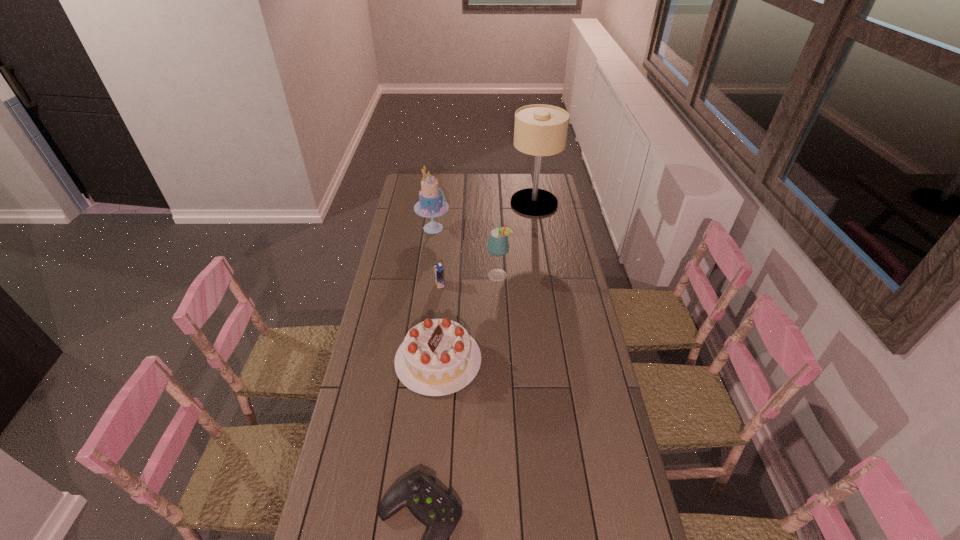
Identify the location of empty space that is in between the birthday cake and the tallest object. (486, 281).

This screenshot has height=540, width=960. I want to click on free space between the third shortest object and the second object from right to left, so click(468, 318).

The width and height of the screenshot is (960, 540). Find the location of `unoccupied area between the fourth tallest object and the cake`. unoccupied area between the fourth tallest object and the cake is located at coordinates (436, 294).

Locate an element on the screen. Image resolution: width=960 pixels, height=540 pixels. free space between the alcohol and the orange_juice is located at coordinates (469, 280).

Where is `free space between the alcohol and the third shortest object`? free space between the alcohol and the third shortest object is located at coordinates (468, 318).

This screenshot has height=540, width=960. I want to click on empty space between the second farthest object and the second nearest object, so (436, 294).

Identify the location of free space that is in between the second nearest object and the alcohol. The image size is (960, 540). (468, 318).

Identify the location of vacant region between the fifth object from left to right and the birthday cake. (468, 318).

Where is `object that is the second nearest to the cake`? object that is the second nearest to the cake is located at coordinates (438, 269).

Identify which object is located as the fifth nearest to the second nearest object. Please provide its 2D coordinates. Your answer should be formatted as a tuple, i.e. [(x, y)], where the tuple contains the x and y coordinates of a point satisfying the conditions above.

[(540, 130)]